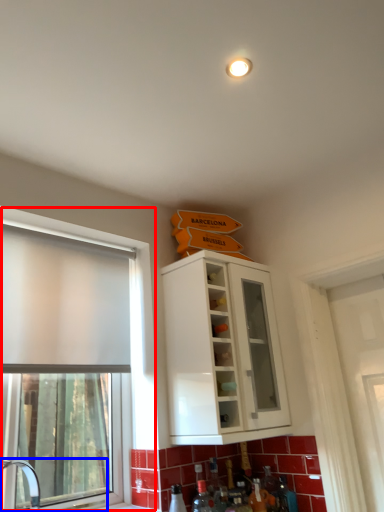
Question: Which object is closer to the camera taking this photo, window (highlighted by a red box) or sink (highlighted by a blue box)?

Choices:
 (A) window
 (B) sink

Answer: (B)